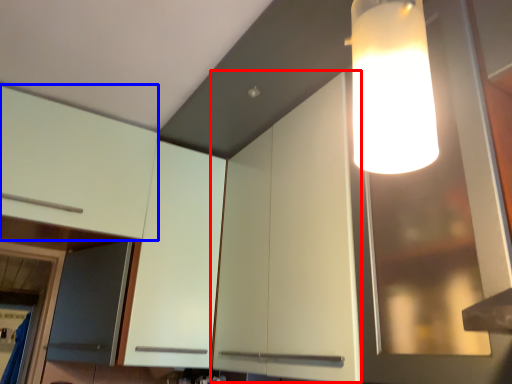
Question: Which of the following is the farthest to the observer, cabinetry (highlighted by a red box) or cabinetry (highlighted by a blue box)?

Choices:
 (A) cabinetry
 (B) cabinetry

Answer: (B)